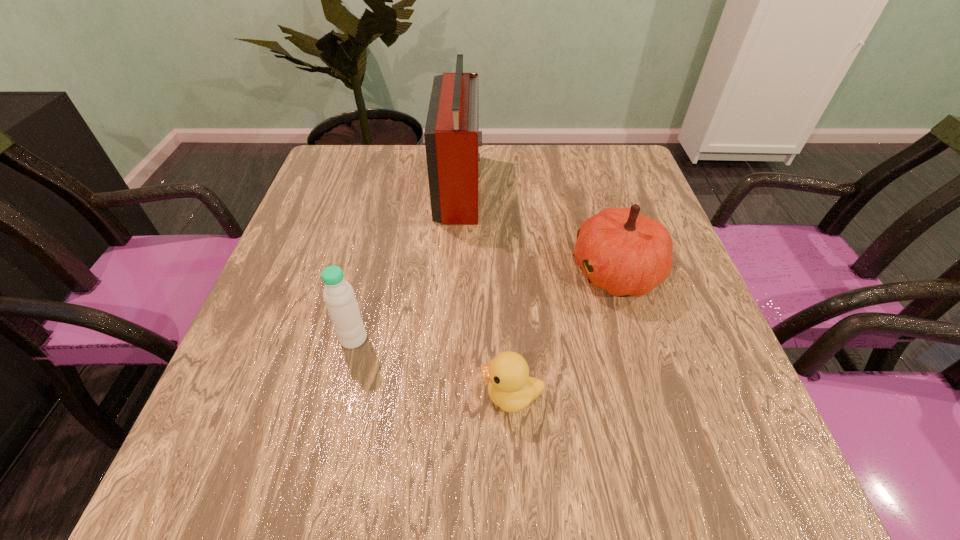
I want to click on free point between the third nearest object and the shortest object, so click(564, 334).

You are a GUI agent. You are given a task and a screenshot of the screen. Output one action in this format:
    pyautogui.click(x=<x>, y=<y>)
    Task: Click on the vacant region between the second nearest object and the rightmost object
    The image size is (960, 540).
    Given the screenshot: What is the action you would take?
    pyautogui.click(x=485, y=305)

Identify the location of empty location between the shortest object and the leftmost object. (433, 367).

Identify which object is the nearest to the farthest object. Please provide its 2D coordinates. Your answer should be formatted as a tuple, i.e. [(x, y)], where the tuple contains the x and y coordinates of a point satisfying the conditions above.

[(622, 251)]

Select which object is the second closest to the water bottle. Please provide its 2D coordinates. Your answer should be formatted as a tuple, i.e. [(x, y)], where the tuple contains the x and y coordinates of a point satisfying the conditions above.

[(451, 134)]

Image resolution: width=960 pixels, height=540 pixels. Identify the location of free location that satisfies the following two spatial constraints: 1. on the front-facing side of the radio receiver; 2. on the front side of the leftmost object. (451, 339).